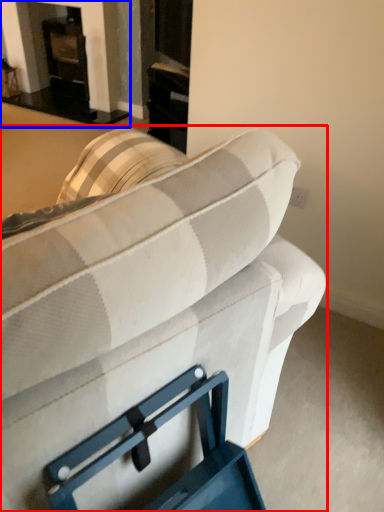
Question: Which object appears farthest to the camera in this image, studio couch (highlighted by a red box) or fireplace (highlighted by a blue box)?

Choices:
 (A) studio couch
 (B) fireplace

Answer: (B)